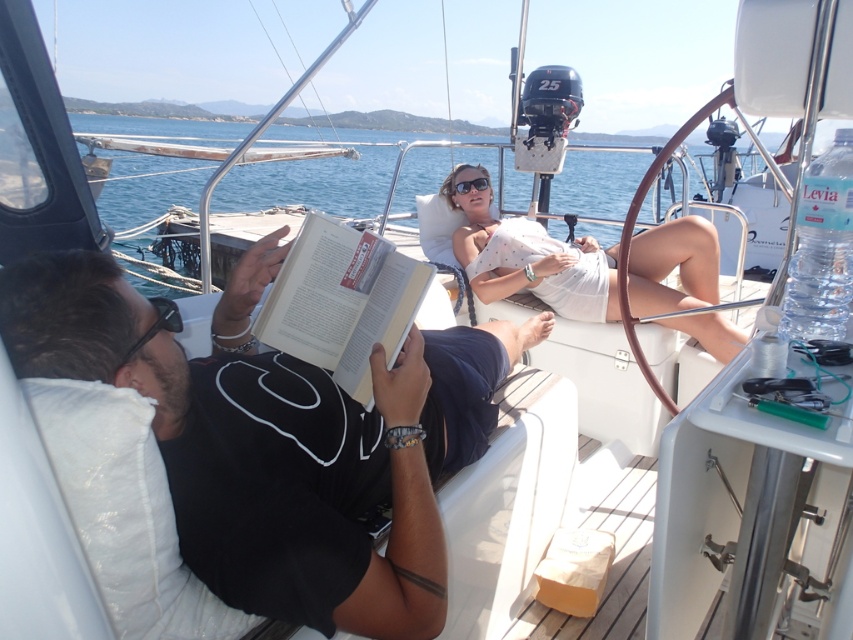
Question: Among these objects, which one is farthest from the camera?

Choices:
 (A) hardcover book at center
 (B) black plastic sunglasses at upper center

Answer: (B)

Question: Which point is farther from the camera taking this photo?

Choices:
 (A) (735, 332)
 (B) (300, 227)
 (C) (283, 188)
 (D) (479, 188)

Answer: (C)

Question: From the image, what is the correct spatial relationship of black matte book at center in relation to white cotton dress at center?

Choices:
 (A) below
 (B) above

Answer: (A)

Question: Can you confirm if white cotton dress at center is thinner than hardcover book at center?

Choices:
 (A) yes
 (B) no

Answer: (B)

Question: Which point appears closest to the camera in this image?

Choices:
 (A) (122, 129)
 (B) (570, 276)
 (C) (398, 588)
 (D) (457, 189)

Answer: (C)

Question: Is black matte book at center below hardcover book at center?

Choices:
 (A) no
 (B) yes

Answer: (B)